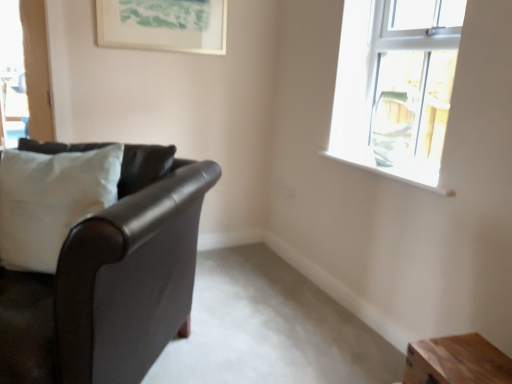
Question: In terms of size, does clear glass window at upper right appear bigger or smaller than white smooth window sill at upper right?

Choices:
 (A) small
 (B) big

Answer: (B)

Question: In terms of height, does clear glass window at upper right look taller or shorter compared to white smooth window sill at upper right?

Choices:
 (A) short
 (B) tall

Answer: (B)

Question: Considering the real-world distances, which object is closest to the white smooth window sill at upper right?

Choices:
 (A) leather couch at left
 (B) clear glass window at upper right
 (C) white fabric swivel chair at upper right
 (D) white fabric pillow at left
 (E) wooden table at lower right

Answer: (C)

Question: Which object is the farthest from the clear glass window at upper right?

Choices:
 (A) leather couch at left
 (B) white fabric pillow at left
 (C) matte white picture frame at upper center
 (D) wooden table at lower right
 (E) white fabric swivel chair at upper right

Answer: (B)